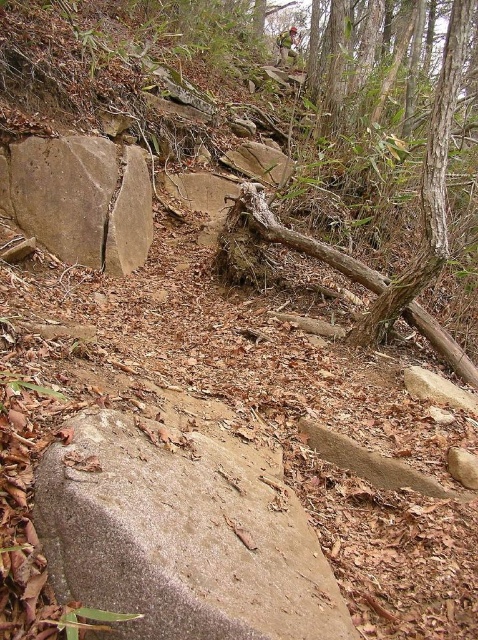
Question: Which object is farther from the camera taking this photo?

Choices:
 (A) brown rough log at center
 (B) brown rough rock at upper left

Answer: (B)

Question: Which object is the closest to the brown rough rock at upper left?

Choices:
 (A) brown rough log at center
 (B) gray rough stone at center

Answer: (A)

Question: Is brown rough rock at upper left closer to camera compared to brown rough log at center?

Choices:
 (A) yes
 (B) no

Answer: (B)

Question: Which is farther from the brown rough log at center?

Choices:
 (A) brown rough rock at upper left
 (B) gray rough stone at center

Answer: (B)

Question: Can you confirm if gray rough stone at center is bigger than brown rough log at center?

Choices:
 (A) yes
 (B) no

Answer: (A)

Question: Observing the image, what is the correct spatial positioning of gray rough stone at center in reference to brown rough log at center?

Choices:
 (A) above
 (B) below

Answer: (B)